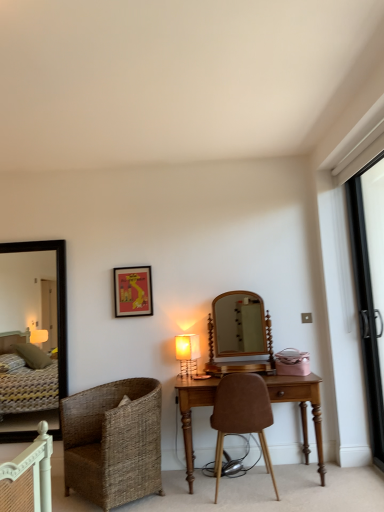
At what (x,y) coordinates should I click in order to perform the action: click on vacant space to the left of brown leather chair at center, positioned as the first chair in right-to-left order. Please return your answer as a coordinate pair (x, y). Image resolution: width=384 pixels, height=512 pixels. Looking at the image, I should click on (193, 497).